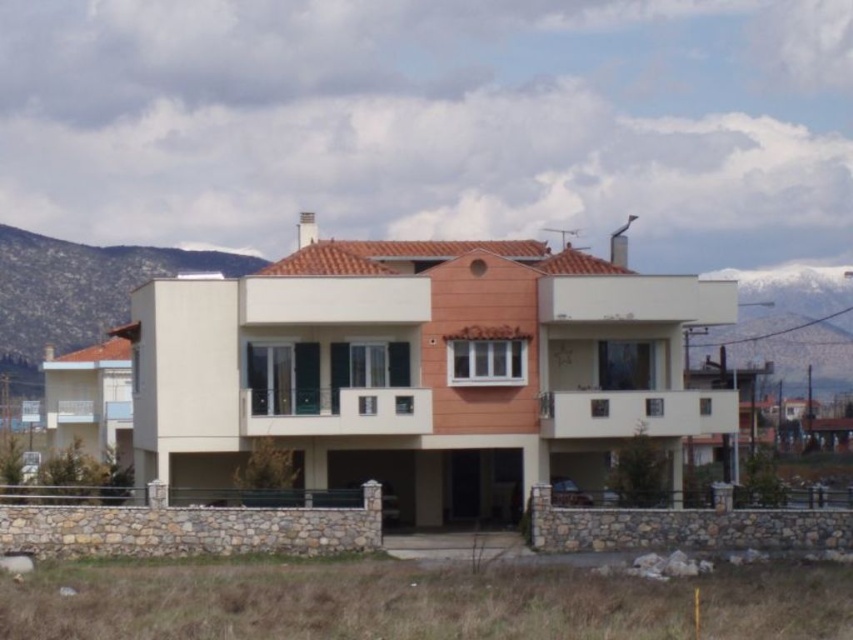
Question: Which object is farther from the camera taking this photo?

Choices:
 (A) brown stone mountain at upper left
 (B) snowy white mountain at upper right

Answer: (A)

Question: Does brown stone mountain at upper left appear over snowy white mountain at upper right?

Choices:
 (A) yes
 (B) no

Answer: (A)

Question: Which point appears closest to the camera in this image?

Choices:
 (A) (786, 340)
 (B) (830, 330)

Answer: (A)

Question: Can you confirm if brown stone mountain at upper left is wider than snowy white mountain at upper right?

Choices:
 (A) yes
 (B) no

Answer: (A)

Question: Which of the following is the closest to the observer?

Choices:
 (A) snowy white mountain at upper right
 (B) brown stone mountain at upper left

Answer: (A)

Question: Is brown stone mountain at upper left smaller than snowy white mountain at upper right?

Choices:
 (A) yes
 (B) no

Answer: (B)